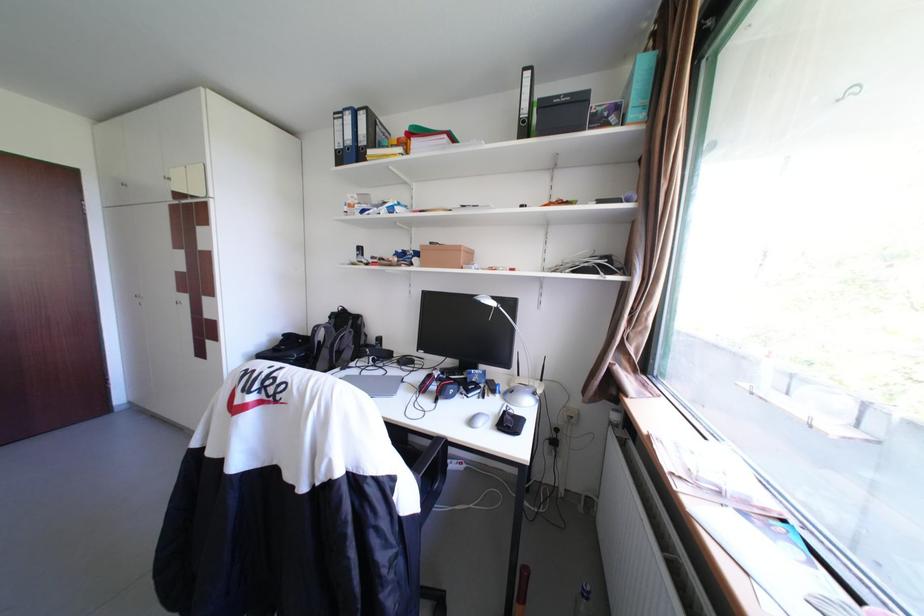
Which object does [521,590] point to?

This point indicates the wooden baseball bat.